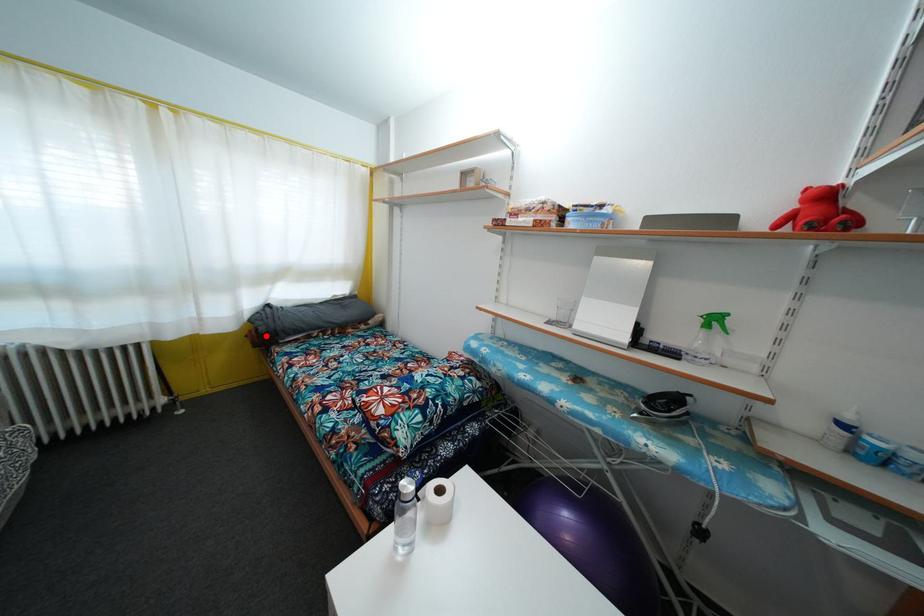
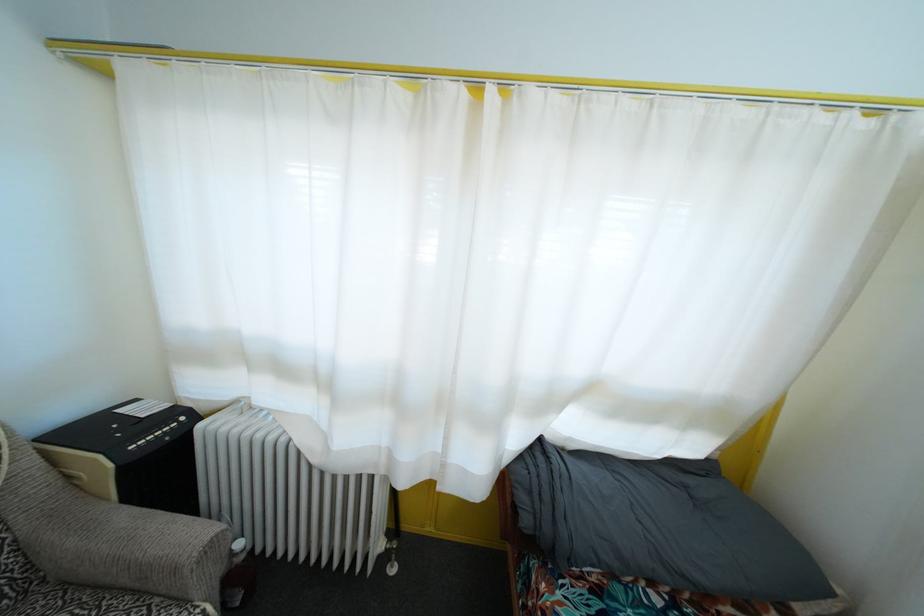
Question: I am providing you with two images of the same scene from different viewpoints. Image1 has a red point marked. In image2, the corresponding 3D location appears at what relative position? Reply with the corresponding letter.

Choices:
 (A) Closer
 (B) Farther

Answer: (B)